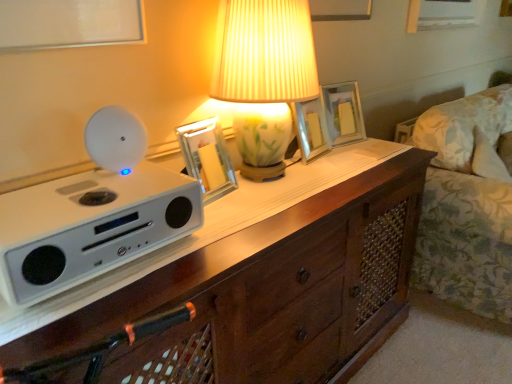
The width and height of the screenshot is (512, 384). I want to click on free area below porcelain floral lamp at center (from a real-world perspective), so click(x=275, y=177).